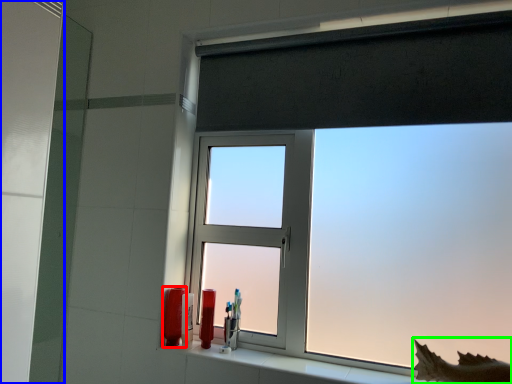
Question: Which object is the farthest from toiletry (highlighted by a red box)? Choose among these: screen door (highlighted by a blue box) or animal (highlighted by a green box).

Choices:
 (A) screen door
 (B) animal

Answer: (B)